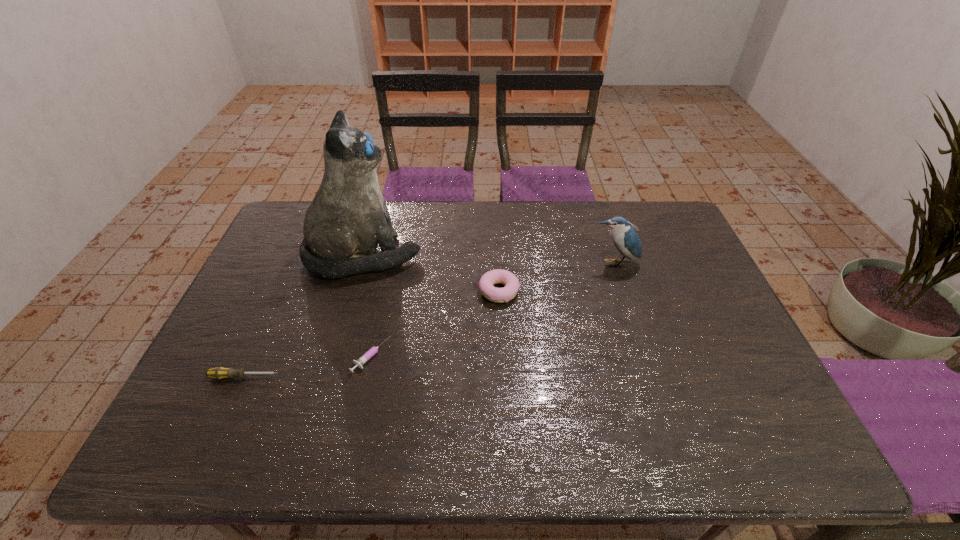
At what (x,y) coordinates should I click in order to perform the action: click on the tallest object. Please return your answer as a coordinate pair (x, y). This screenshot has width=960, height=540. Looking at the image, I should click on (348, 217).

You are a GUI agent. You are given a task and a screenshot of the screen. Output one action in this format:
    pyautogui.click(x=<x>, y=<y>)
    Task: Click on the rightmost object
    The height and width of the screenshot is (540, 960).
    Given the screenshot: What is the action you would take?
    pyautogui.click(x=625, y=238)

Where is `bird`? The height and width of the screenshot is (540, 960). bird is located at coordinates (x=625, y=238).

Identify the location of the second object from right to left. (498, 276).

Image resolution: width=960 pixels, height=540 pixels. Find the location of `the third shortest object`. the third shortest object is located at coordinates (498, 276).

This screenshot has width=960, height=540. What are the coordinates of `the fourth tallest object` in the screenshot? It's located at (218, 373).

Locate an element on the screen. The width and height of the screenshot is (960, 540). the shortest object is located at coordinates (371, 352).

Find the location of a particular element. This screenshot has width=960, height=540. free space located 0.130m at the face of the tallest object is located at coordinates (463, 255).

Find the location of `vacant space located at the tip of the rightmost object's beak`. vacant space located at the tip of the rightmost object's beak is located at coordinates 636,334.

The width and height of the screenshot is (960, 540). Identify the location of free spot located 0.310m on the back of the doughnut. (495, 217).